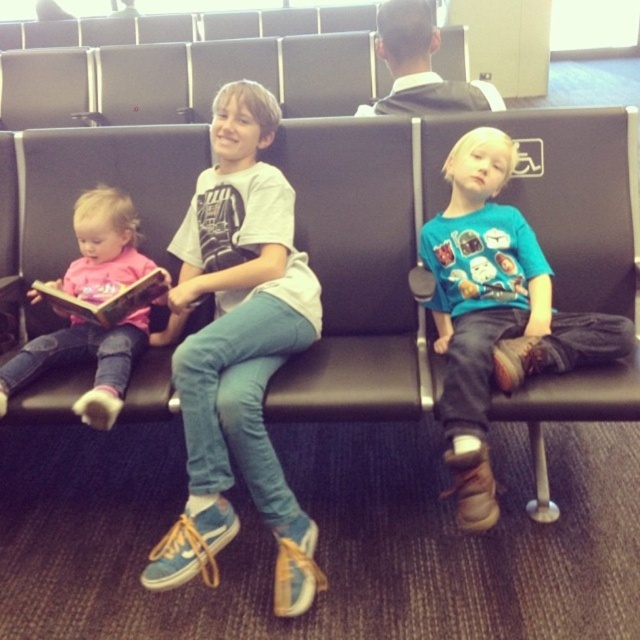
You are a parent trying to locate your child in the airport waiting area. You remember your daughter is wearing a pink long sleeved shirt and reading a hardcover book. Based on the image, is the pink fabric shirt at left and hardcover book at left positioned in a way that suggests she is reading her book?

Yes, the pink fabric shirt at left is located below the hardcover book at left, indicating the child wearing the pink shirt is positioned to read the book.

You are a photographer positioned at the point marked by coordinates point (237,349). You want to capture a photo of the light blue denim jeans at center. Which direction should you face to ensure the jeans are in the frame?

The point (237,349) marks the location of the light blue denim jeans at center, so facing towards that point will ensure the jeans are in the frame.